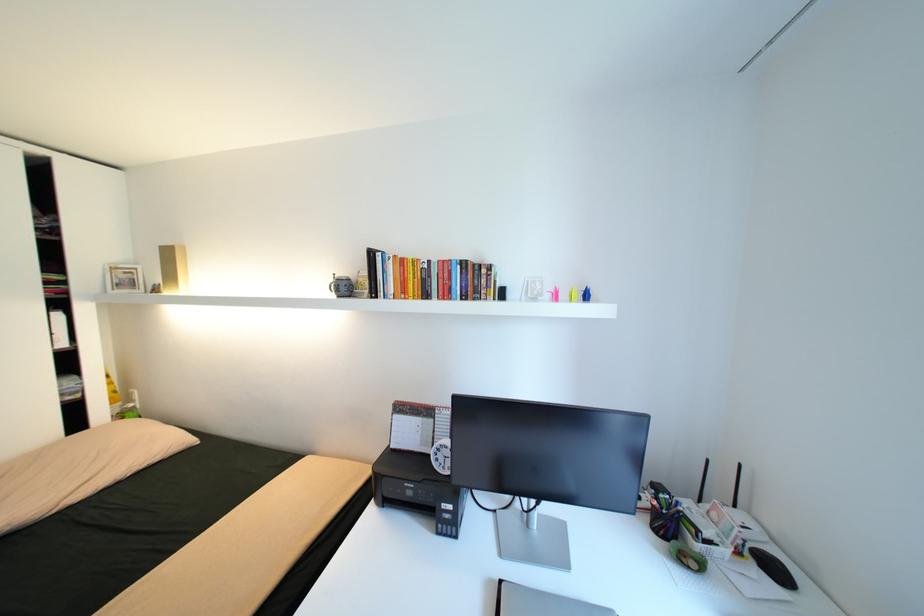
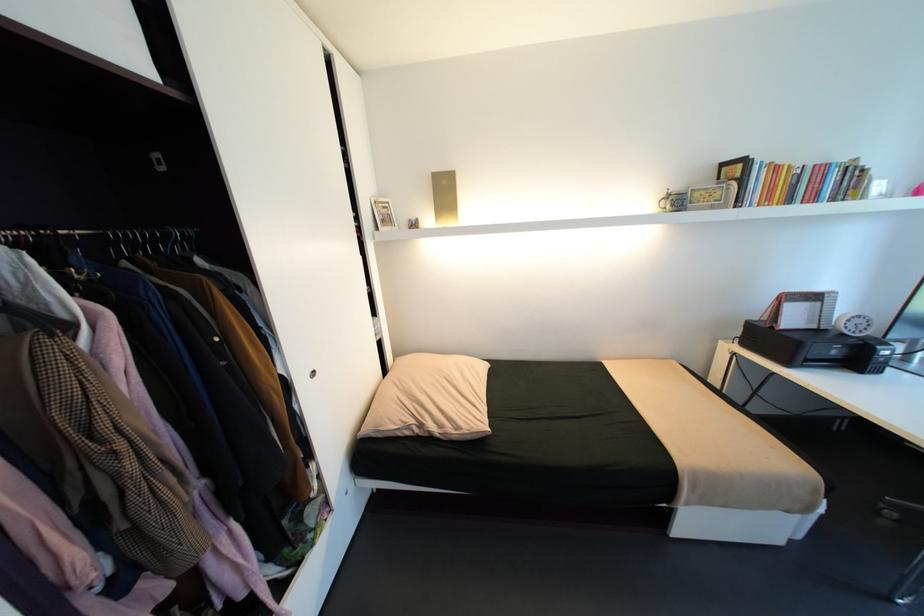
Locate, in the second image, the point that corresponds to pixel 445 262 in the first image.

(821, 166)